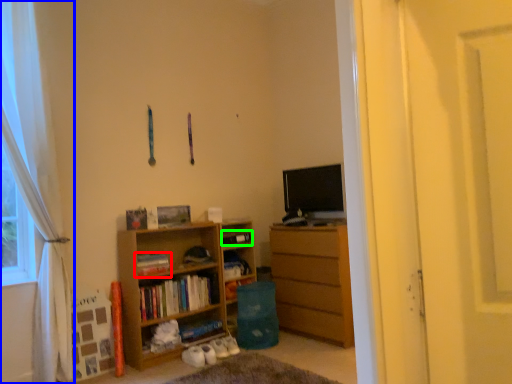
Question: Based on their relative distances, which object is nearer to book (highlighted by a red box)? Choose from curtain (highlighted by a blue box) and book (highlighted by a green box).

Choices:
 (A) curtain
 (B) book

Answer: (B)